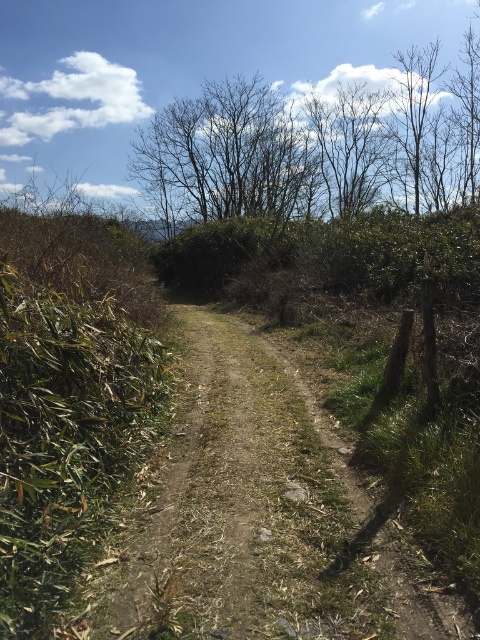
Question: Does dull brown dirt track at center have a lesser width compared to bare branches at upper center?

Choices:
 (A) yes
 (B) no

Answer: (A)

Question: Is dull brown dirt track at center bigger than bare branches at upper center?

Choices:
 (A) no
 (B) yes

Answer: (A)

Question: Among these points, which one is nearest to the camera?

Choices:
 (A) (477, 113)
 (B) (186, 566)

Answer: (B)

Question: Considering the relative positions of dull brown dirt track at center and bare branches at upper center in the image provided, where is dull brown dirt track at center located with respect to bare branches at upper center?

Choices:
 (A) above
 (B) below

Answer: (B)

Question: Which point appears farthest from the camera in this image?

Choices:
 (A) (320, 616)
 (B) (276, 198)

Answer: (B)